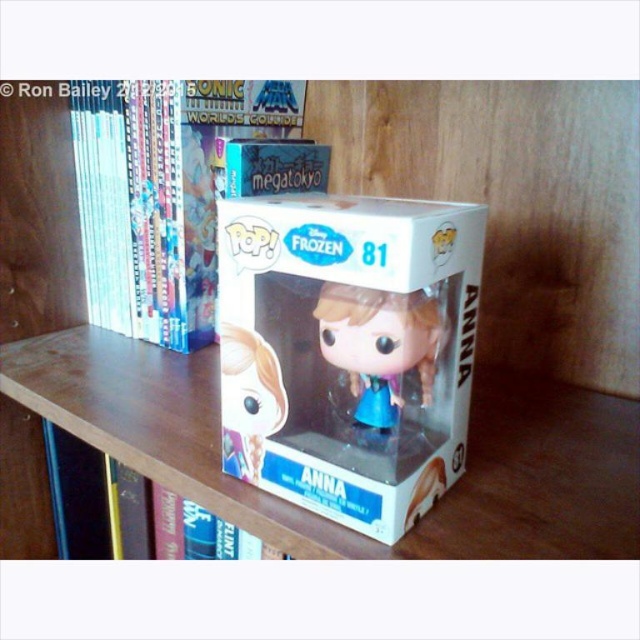
Who is positioned more to the right, translucent plastic figurine at center or translucent plastic anna figurine at center?

Positioned to the right is translucent plastic figurine at center.

Is translucent plastic figurine at center to the left of translucent plastic anna figurine at center from the viewer's perspective?

Incorrect, translucent plastic figurine at center is not on the left side of translucent plastic anna figurine at center.

In order to click on translucent plastic figurine at center in this screenshot , I will do `click(380, 346)`.

Identify the location of translucent plastic figurine at center. (380, 346).

Is point (468, 243) farther from viewer compared to point (221, 454)?

No.

Who is higher up, white glossy box at center or translucent plastic anna figurine at center?

white glossy box at center is higher up.

You are a GUI agent. You are given a task and a screenshot of the screen. Output one action in this format:
    pyautogui.click(x=<x>, y=<y>)
    Task: Click on the white glossy box at center
    Image resolution: width=640 pixels, height=640 pixels.
    Given the screenshot: What is the action you would take?
    pyautogui.click(x=348, y=349)

Is white glossy box at center closer to the viewer compared to translucent plastic figurine at center?

Yes, it is.

Between white glossy box at center and translucent plastic figurine at center, which one is positioned higher?

white glossy box at center is above.

Find the location of a particular element. This screenshot has width=640, height=640. white glossy box at center is located at coordinates (x=348, y=349).